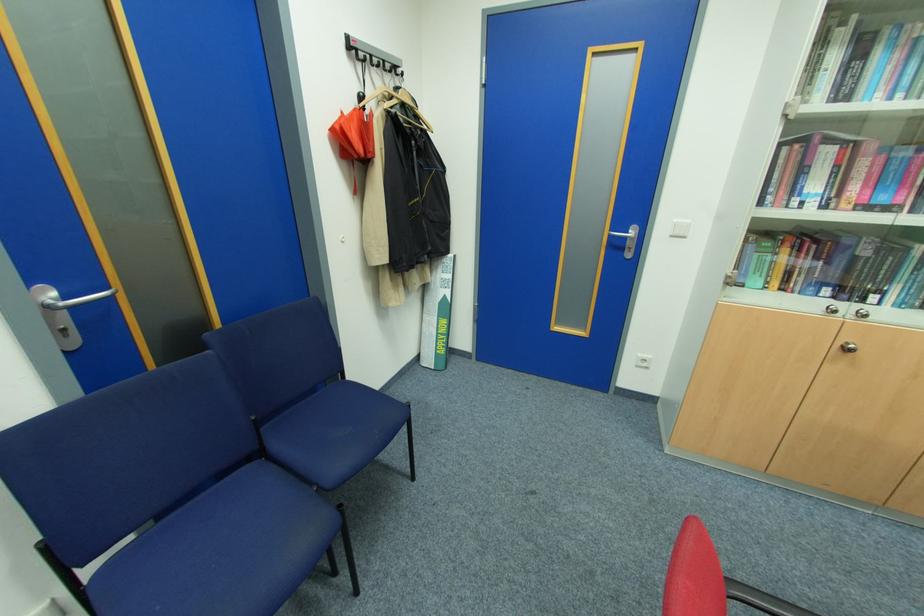
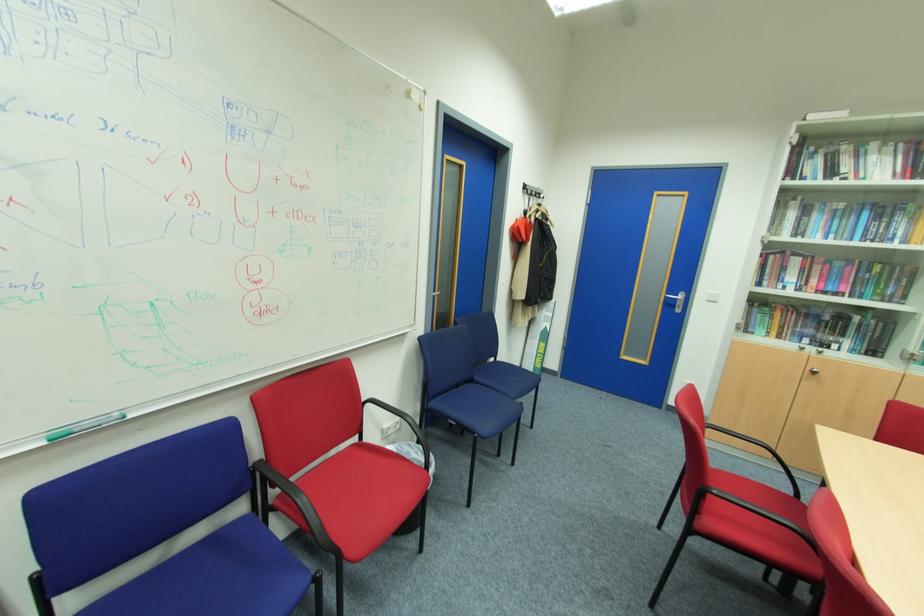
In the second image, find the point that corresponds to (747,286) in the first image.

(756, 334)